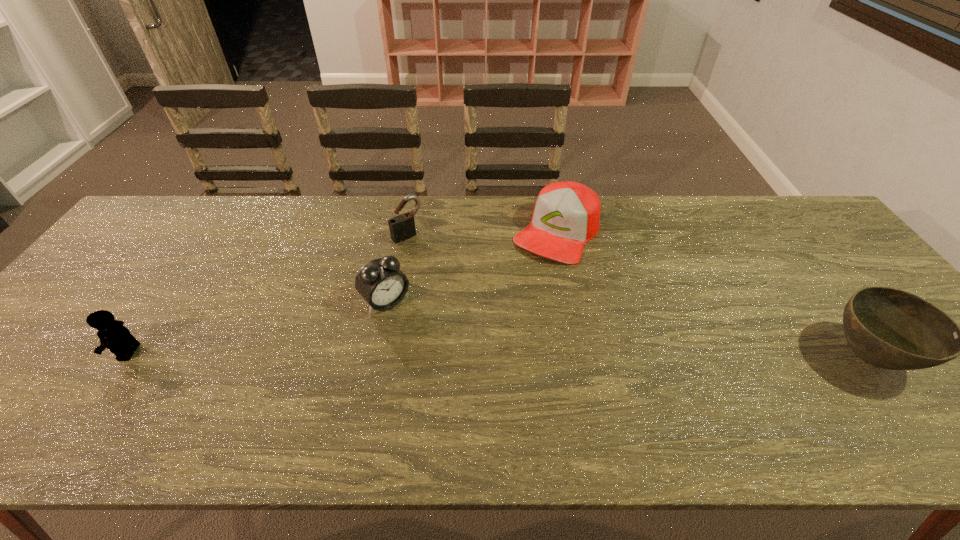
At what (x,y) coordinates should I click in order to perform the action: click on vacant space in between the padlock and the Lego. Please return your answer as a coordinate pair (x, y). Image resolution: width=960 pixels, height=540 pixels. Looking at the image, I should click on (268, 294).

Find the location of a particular element. blank region between the bowl and the padlock is located at coordinates (637, 296).

This screenshot has height=540, width=960. In order to click on empty location between the rightmost object and the Lego in this screenshot , I will do `click(498, 355)`.

Where is `empty space that is in between the Lego and the rightmost object`? The image size is (960, 540). empty space that is in between the Lego and the rightmost object is located at coordinates (498, 355).

Identify the location of vacant area between the padlock and the baseball cap. The width and height of the screenshot is (960, 540). (482, 234).

At what (x,y) coordinates should I click in order to perform the action: click on object that stands as the second closest to the fourth object from left to right. Please return your answer as a coordinate pair (x, y). Image resolution: width=960 pixels, height=540 pixels. Looking at the image, I should click on (382, 284).

Identify the location of object that is the third closest to the Lego. (567, 214).